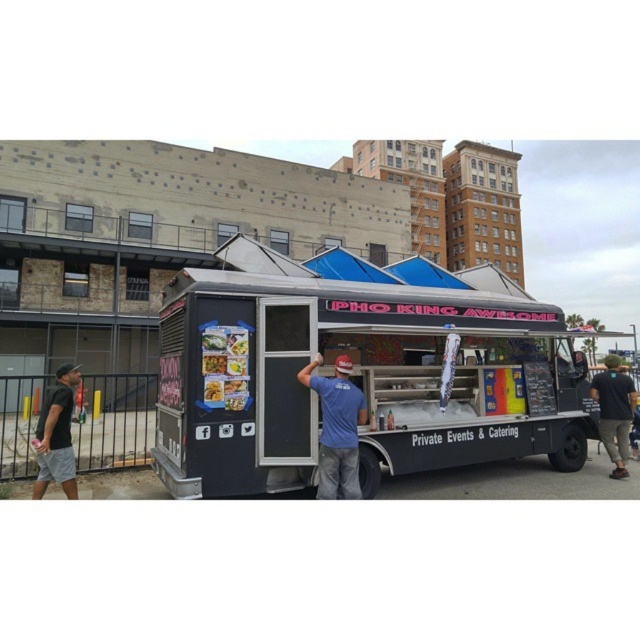
You are a customer standing at the food truck and want to grab both the blue cotton shirt at center and the black cotton shirt at right. Can you pick them up without moving more than 5 meters from your starting position?

The blue cotton shirt at center and the black cotton shirt at right are 4.75 meters apart. Since you can move up to 5 meters, you can reach both shirts within the allowed distance.

You are a customer looking at the food truck menu displayed on the truck. The menu shows two items at the center of the display. Which item is placed higher up between the matte plastic food at center and the smooth glossy rice noodles at center?

The smooth glossy rice noodles at center are placed higher up than the matte plastic food at center.

You are a customer at the food truck and see two shirts on display. The blue cotton shirt at center and the black cotton shirt at right. Which shirt is smaller in size?

The blue cotton shirt at center has a smaller size compared to the black cotton shirt at right.